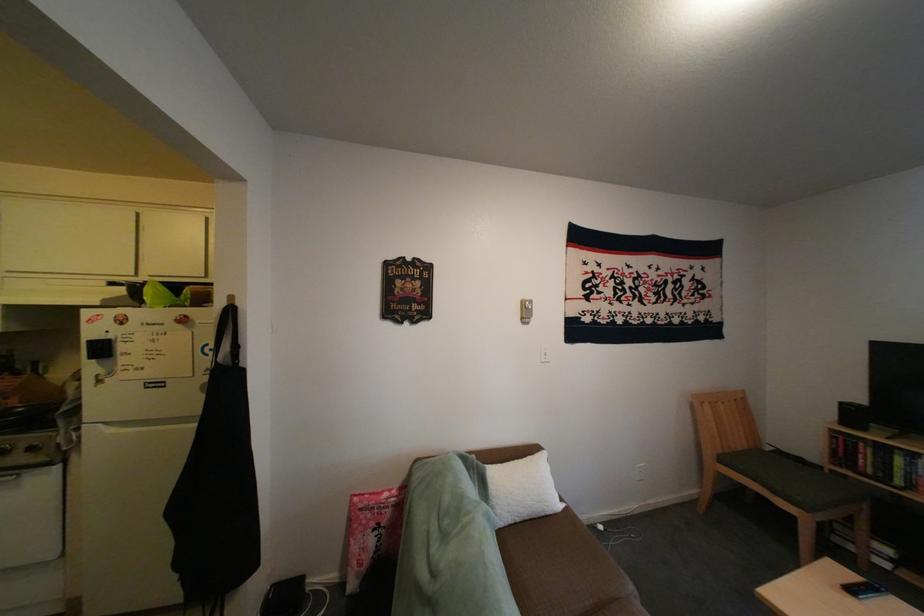
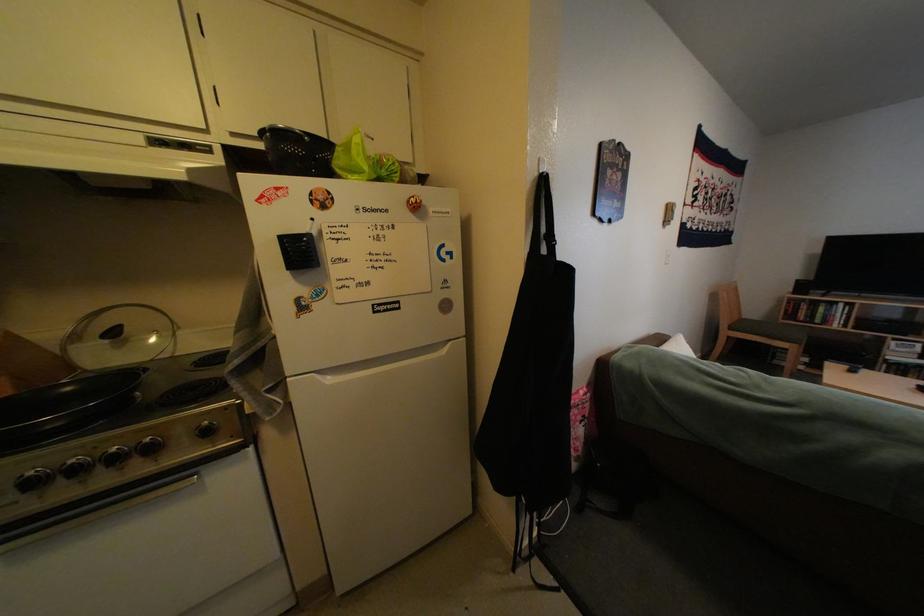
In the second image, find the point that corresponds to the point at 202,302 in the first image.

(412, 176)